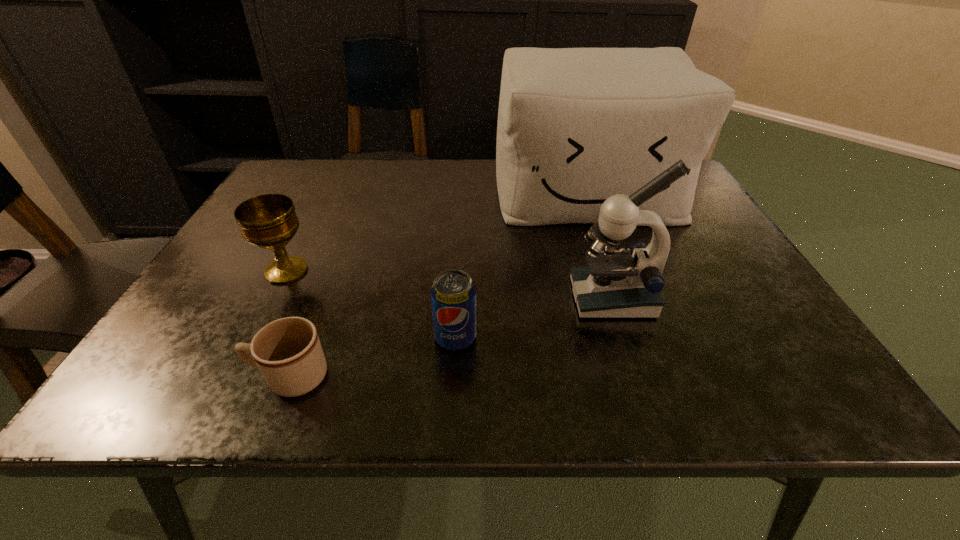
Image resolution: width=960 pixels, height=540 pixels. I want to click on the tallest object, so click(x=576, y=126).

The height and width of the screenshot is (540, 960). I want to click on the farthest object, so click(576, 126).

The height and width of the screenshot is (540, 960). I want to click on the second tallest object, so click(x=616, y=283).

The height and width of the screenshot is (540, 960). In order to click on chalice in this screenshot , I will do `click(269, 221)`.

Locate an element on the screen. Image resolution: width=960 pixels, height=540 pixels. soda is located at coordinates (453, 294).

At what (x,y) coordinates should I click in order to perform the action: click on the second shortest object. Please return your answer as a coordinate pair (x, y). Looking at the image, I should click on (453, 294).

Find the location of a particular element. This screenshot has height=540, width=960. the shortest object is located at coordinates (288, 352).

This screenshot has width=960, height=540. I want to click on mug, so click(288, 352).

Find the location of a particular element. This screenshot has height=540, width=960. vacant space located 0.290m on the side of the farthest object with the smiley face is located at coordinates (632, 316).

I want to click on free region located at the eyepiece of the fourth shortest object, so click(386, 298).